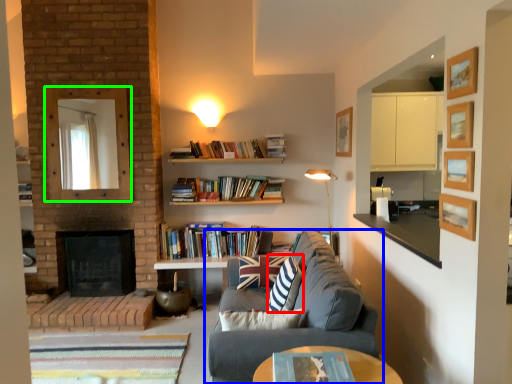
Question: Estimate the real-world distances between objects in this image. Which object is closer to throw pillow (highlighted by a red box), studio couch (highlighted by a blue box) or mirror (highlighted by a green box)?

Choices:
 (A) studio couch
 (B) mirror

Answer: (A)